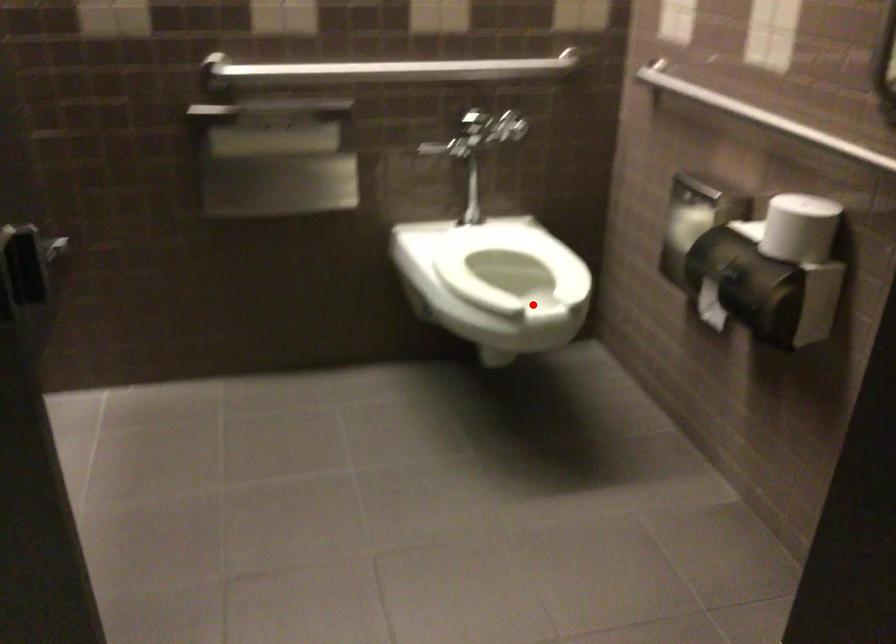
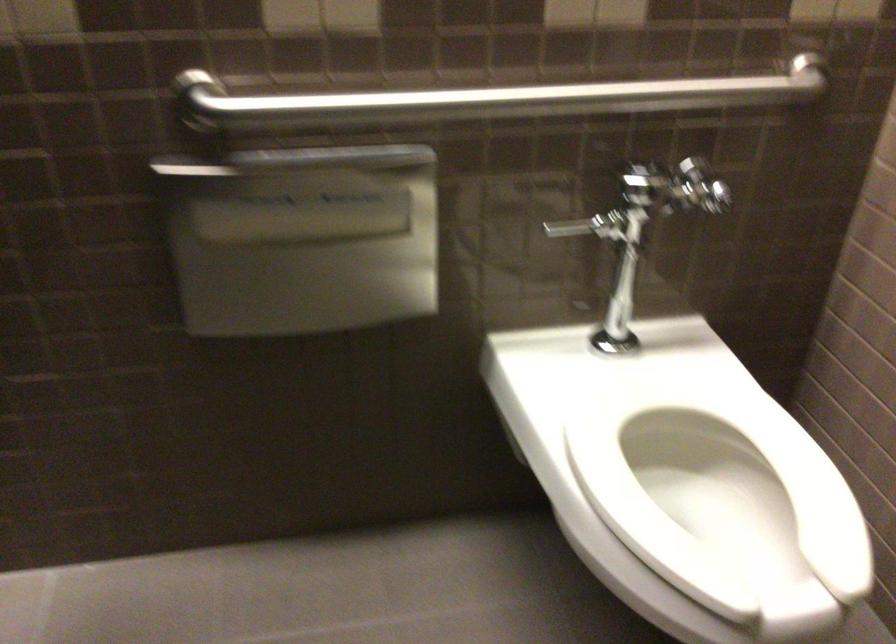
Question: I am providing you with two images of the same scene from different viewpoints. Given a red point in image1, look at the same physical point in image2. Is it:

Choices:
 (A) Closer to the viewpoint
 (B) Farther from the viewpoint

Answer: (A)